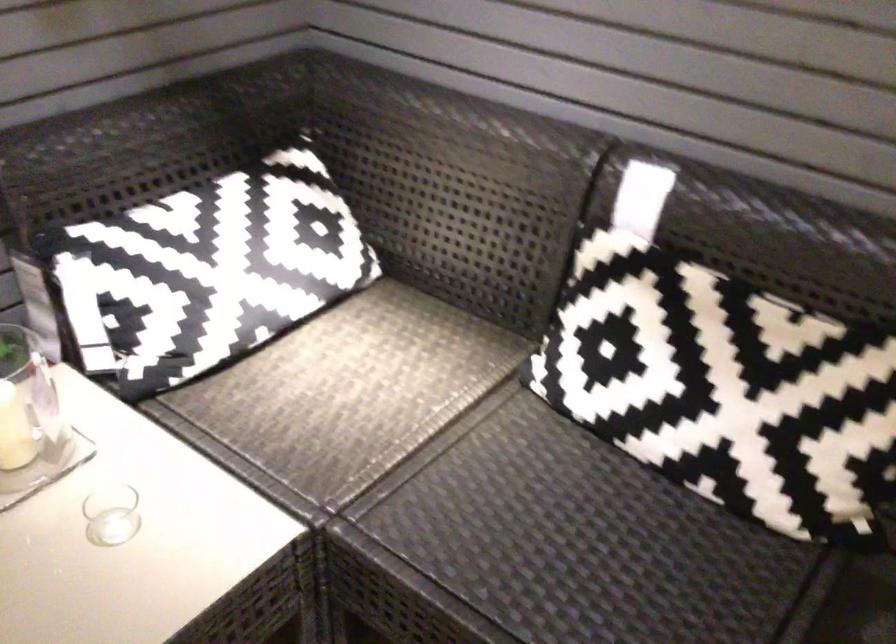
The images are taken continuously from a first-person perspective. In which direction is your viewpoint rotating?

The rotation direction of the camera is left-down.